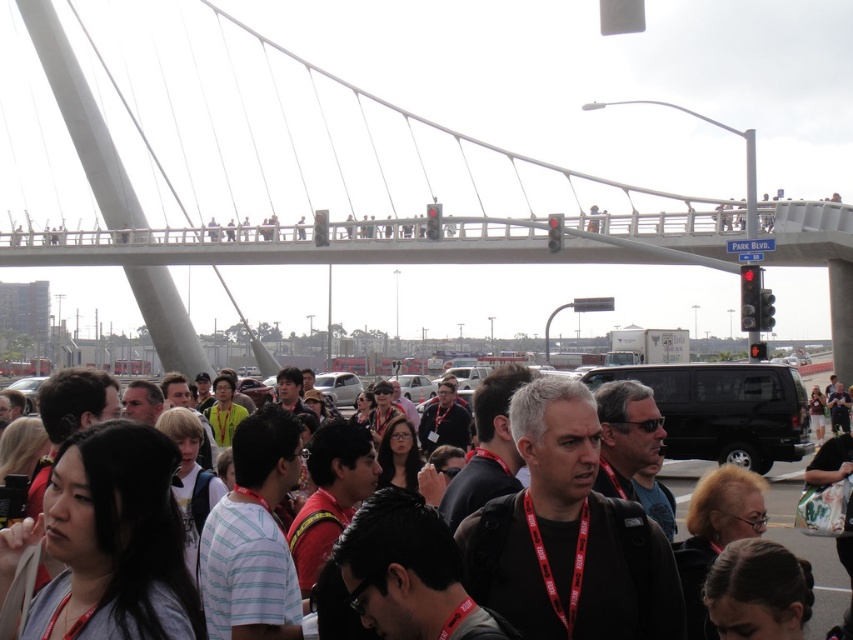
Question: Which point appears closest to the camera in this image?

Choices:
 (A) (694, 116)
 (B) (680, 534)

Answer: (B)

Question: Which of the following is the farthest from the observer?

Choices:
 (A) (22, 90)
 (B) (677, 499)

Answer: (A)

Question: From the image, what is the correct spatial relationship of white concrete pedestrian bridge at upper center in relation to matte black backpack at center?

Choices:
 (A) above
 (B) below

Answer: (A)

Question: Which point is closer to the camera?

Choices:
 (A) white concrete pedestrian bridge at upper center
 (B) matte black backpack at center

Answer: (B)

Question: Does white concrete pedestrian bridge at upper center come behind matte black backpack at center?

Choices:
 (A) no
 (B) yes

Answer: (B)

Question: Does white concrete pedestrian bridge at upper center come in front of matte black backpack at center?

Choices:
 (A) yes
 (B) no

Answer: (B)